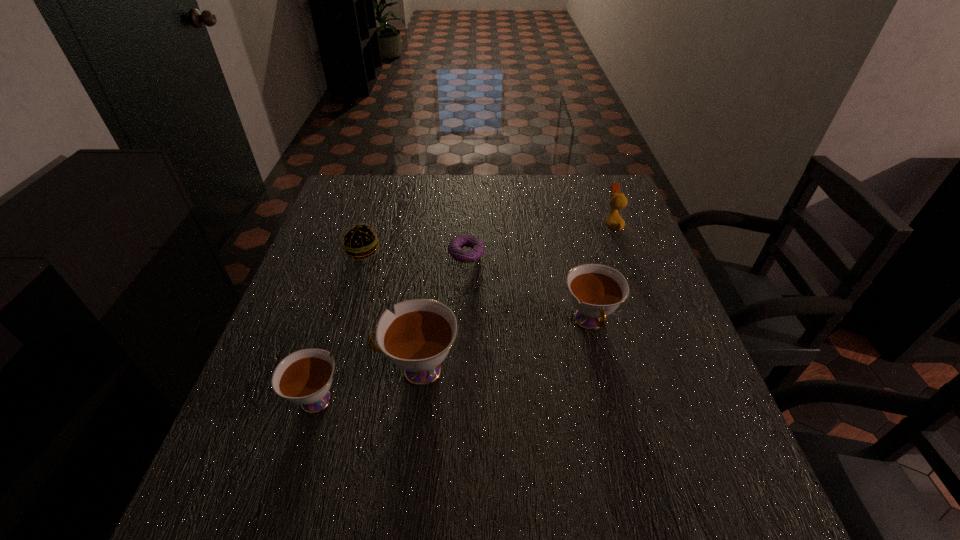
The width and height of the screenshot is (960, 540). I want to click on object that is at the far edge, so click(618, 201).

I want to click on object that is at the near edge, so click(x=304, y=377).

Find the location of a particular element. The image size is (960, 540). teacup located in the left edge section of the desktop is located at coordinates (304, 377).

Where is `patty that is at the left edge`? patty that is at the left edge is located at coordinates (358, 241).

Find the location of a particular element. This screenshot has width=960, height=540. teacup that is positioned at the right edge is located at coordinates (596, 290).

You are a GUI agent. You are given a task and a screenshot of the screen. Output one action in this format:
    pyautogui.click(x=<x>, y=<y>)
    Task: Click on the duck at the right edge
    This screenshot has width=960, height=540.
    Given the screenshot: What is the action you would take?
    pyautogui.click(x=618, y=201)

Identify the location of object that is positioned at the near left corner. This screenshot has width=960, height=540. (304, 377).

Image resolution: width=960 pixels, height=540 pixels. In order to click on object at the far right corner in this screenshot , I will do `click(618, 201)`.

The width and height of the screenshot is (960, 540). In the image, there is a desktop. Identify the location of vacant space at the far edge. click(504, 192).

Locate an element on the screen. The width and height of the screenshot is (960, 540). blank area at the left edge is located at coordinates 310,287.